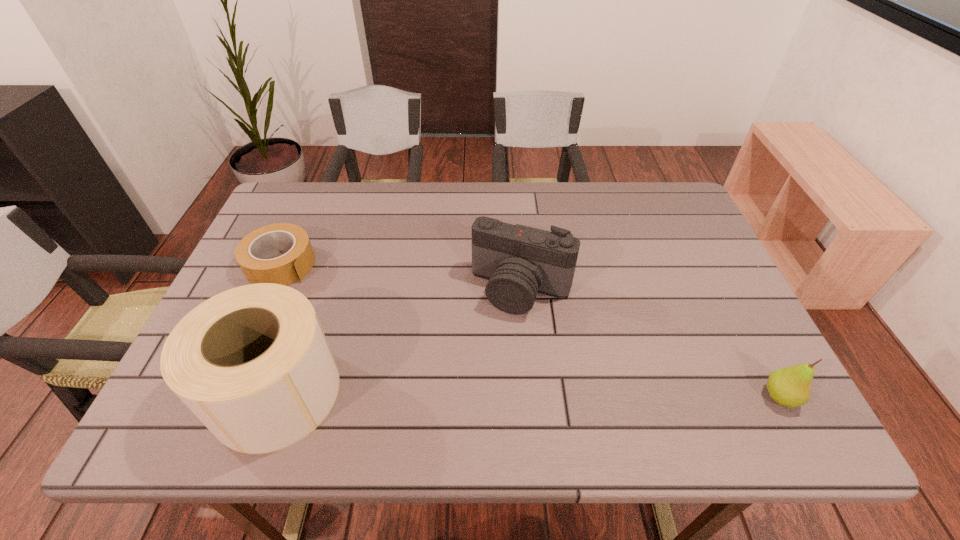
At what (x,y) coordinates should I click in order to perform the action: click on vacant space on the desktop that is between the toilet tissue and the second shortest object and is positioned at the lens of the third object from left to right. Please return your answer as a coordinate pair (x, y). This screenshot has width=960, height=540. Looking at the image, I should click on (478, 394).

This screenshot has height=540, width=960. In order to click on vacant space on the desktop that is between the toilet tissue and the pear and is positioned at the edge of the shortest object in this screenshot , I will do `click(461, 394)`.